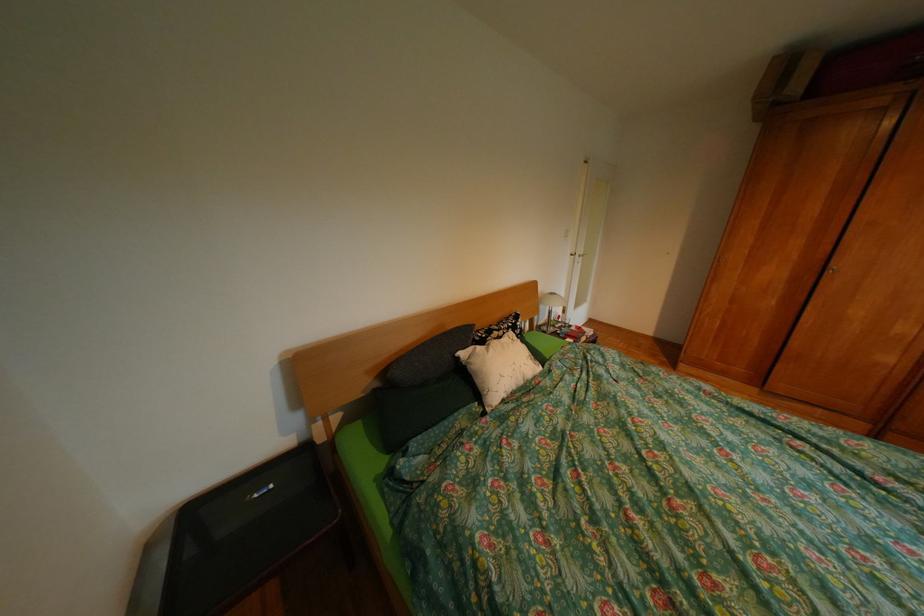
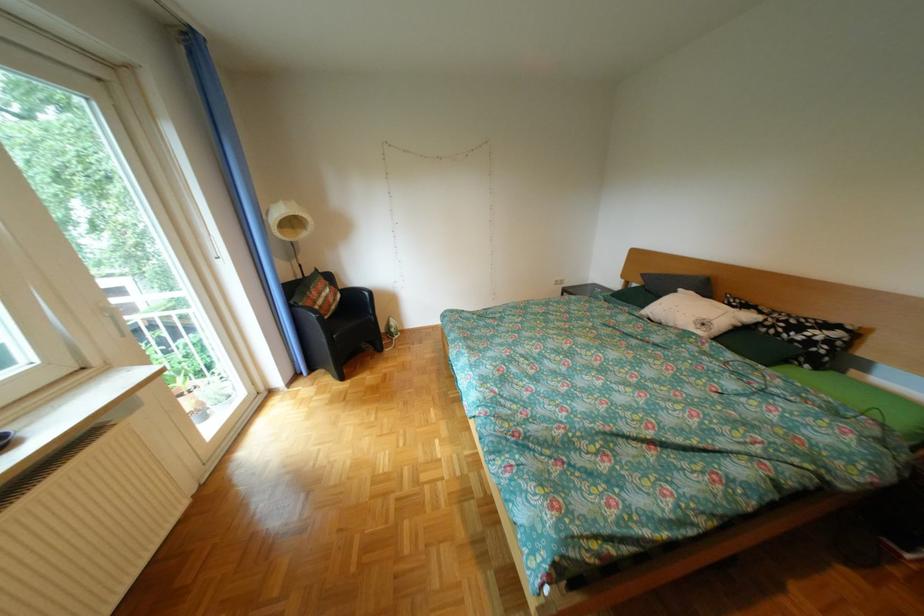
Where in the second image is the point corresponding to (x=513, y=331) from the first image?

(775, 313)